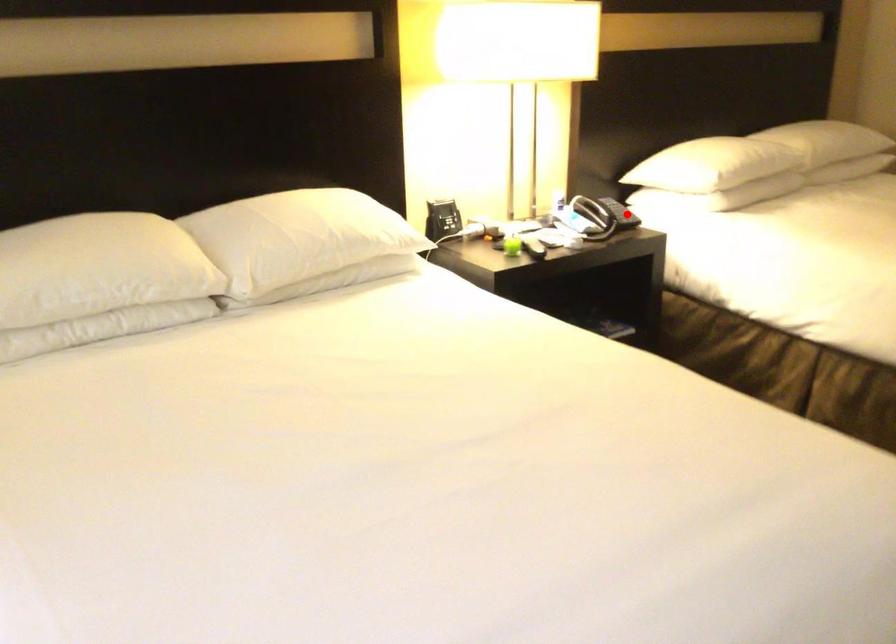
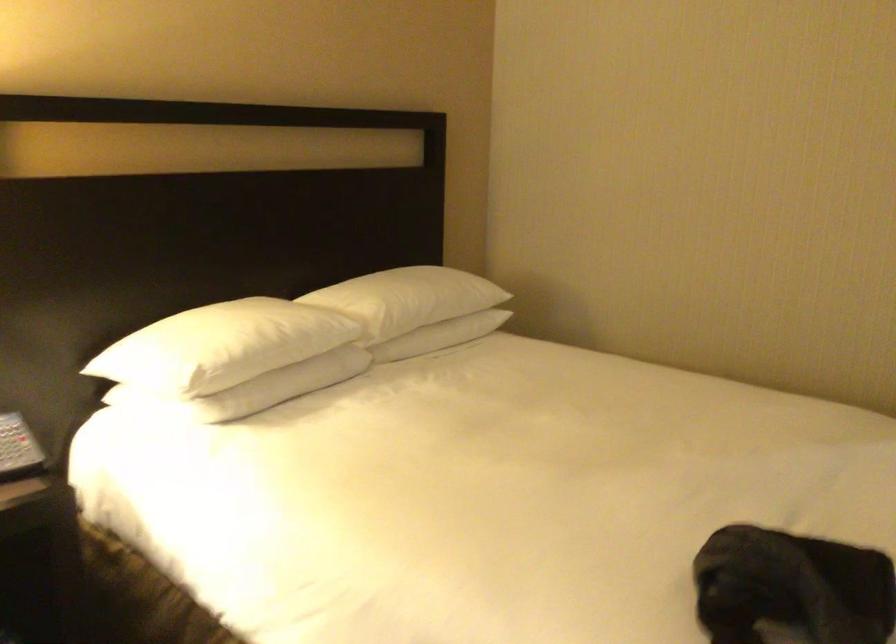
Where in the second image is the point corresponding to the highlighted location from the first image?

(19, 449)